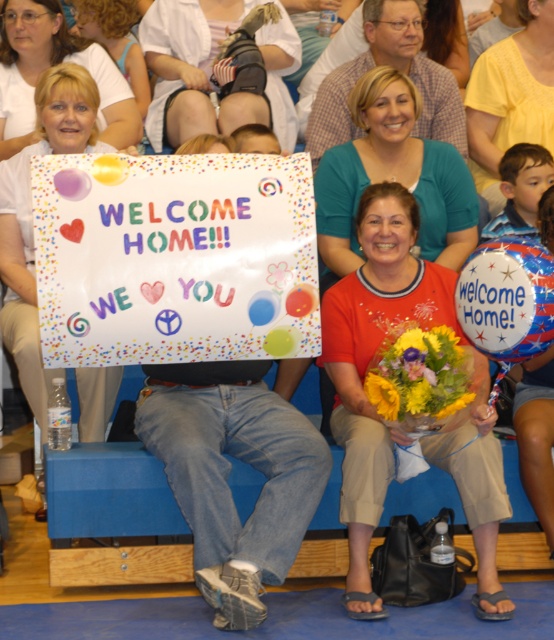
Between matte red shirt at center and yellow cotton shirt at center, which one has less height?

With less height is yellow cotton shirt at center.

Which is below, matte red shirt at center or yellow cotton shirt at center?

matte red shirt at center is below.

Does point (444, 276) come farther from viewer compared to point (541, 141)?

No, (444, 276) is closer to viewer.

Where is `matte red shirt at center`? This screenshot has height=640, width=554. matte red shirt at center is located at coordinates (371, 358).

Is matte black knee brace at center closer to the viewer compared to yellow cotton shirt at center?

No, matte black knee brace at center is further to the viewer.

Which is more to the right, matte black knee brace at center or yellow cotton shirt at center?

From the viewer's perspective, yellow cotton shirt at center appears more on the right side.

Which is behind, point (284, 32) or point (479, 120)?

The point (284, 32) is more distant.

At what (x,y) coordinates should I click in order to perform the action: click on matte black knee brace at center. Please return your answer as a coordinate pair (x, y). Image resolution: width=554 pixels, height=640 pixels. Looking at the image, I should click on (211, 70).

Is yellow cotton shirt at center taller than teal fabric shirt at upper center?

Yes.

Is point (469, 154) more distant than point (321, 92)?

Yes, point (469, 154) is farther from viewer.

Where is `yellow cotton shirt at center`? The height and width of the screenshot is (640, 554). yellow cotton shirt at center is located at coordinates (510, 97).